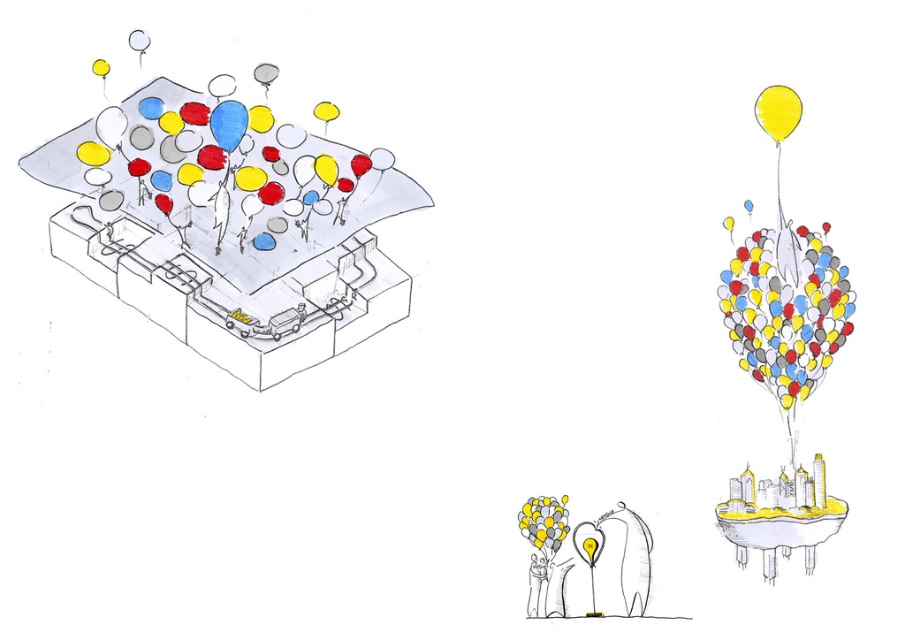
You are a character in the image trying to reach the yellow matte balloon at upper right from the matte gray box at center. Considering their heights, can you reach the balloon without jumping?

The matte gray box at center is taller than the yellow matte balloon at upper right, so you can reach the balloon without jumping by standing on the box.

You are standing in front of the image and want to place a new red balloon between the matte gray box at center and the yellow matte balloon at upper right. Based on their positions, which object should the red balloon be closer to?

The red balloon should be placed closer to the yellow matte balloon at upper right because the matte gray box at center is to the left of the yellow matte balloon at upper right, making the yellow balloon the rightmost object.

You are a character in the image who wants to place a small toy on top of the matte gray box at center without it falling off. Considering the yellow matte balloon at upper right is above the box, where should you place the toy to ensure it stays?

Place the toy on the matte gray box at center away from the yellow matte balloon at upper right to avoid it being knocked off by the balloon.